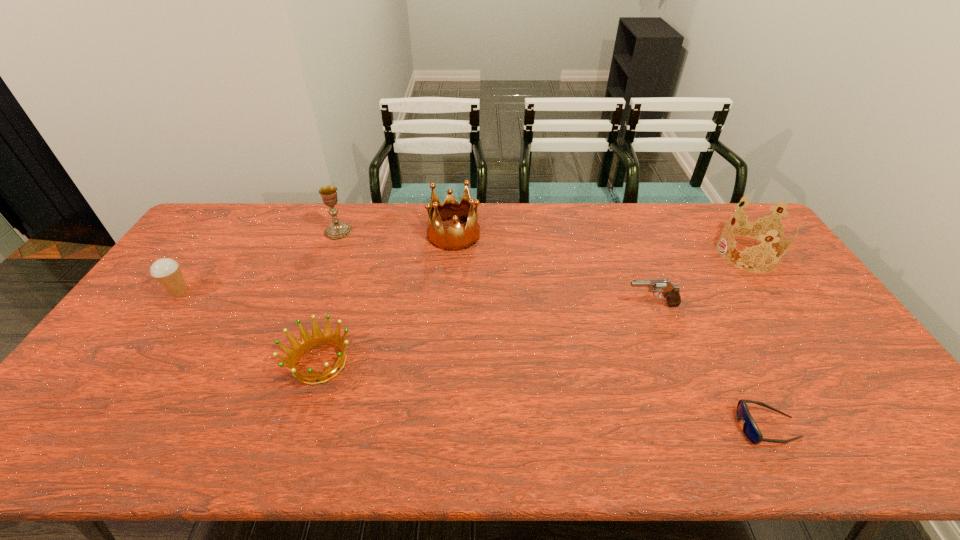
At what (x,y) coordinates should I click in order to perform the action: click on vacant space at the right edge of the desktop. Please return your answer as a coordinate pair (x, y). Image resolution: width=960 pixels, height=540 pixels. Looking at the image, I should click on (838, 387).

In the image, there is a desktop. Where is `vacant space at the far left corner`? vacant space at the far left corner is located at coordinates (213, 216).

This screenshot has height=540, width=960. I want to click on free point between the sixth farthest object and the chalice, so click(329, 297).

Identify the location of vacant space that is in between the chalice and the sunglasses. (553, 329).

What are the coordinates of `free space that is in between the chalice and the shortest object` in the screenshot? It's located at (553, 329).

Where is `free space between the chalice and the leftmost object`? This screenshot has width=960, height=540. free space between the chalice and the leftmost object is located at coordinates (258, 262).

Find the location of a particular element. The width and height of the screenshot is (960, 540). blank region between the fourth shortest object and the chalice is located at coordinates (258, 262).

You are a GUI agent. You are given a task and a screenshot of the screen. Output one action in this format:
    pyautogui.click(x=<x>, y=<y>)
    Task: Click on the vacant space that is in between the sixth object from left to right and the shortest crown
    This screenshot has width=960, height=540.
    Given the screenshot: What is the action you would take?
    pyautogui.click(x=543, y=395)

Locate an element on the screen. free space between the shortest crown and the nearest object is located at coordinates (543, 395).

This screenshot has width=960, height=540. I want to click on vacant area that lies between the rightmost crown and the second nearest object, so (x=534, y=308).